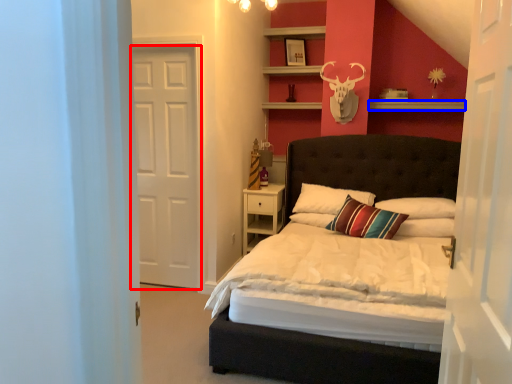
Question: Which of the following is the farthest to the observer, door (highlighted by a red box) or shelf (highlighted by a blue box)?

Choices:
 (A) door
 (B) shelf

Answer: (B)